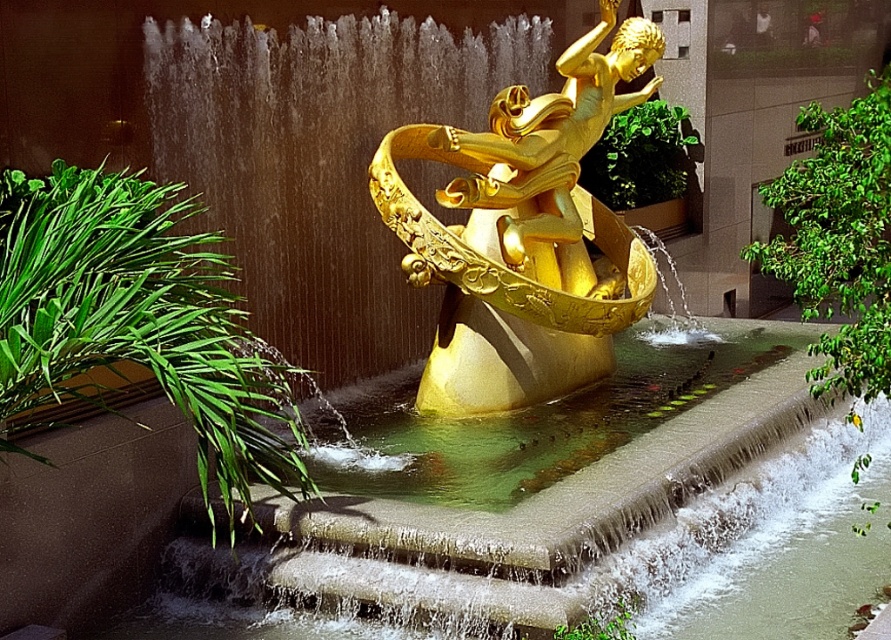
Question: Considering the real-world distances, which object is farthest from the clear water at fountain center?

Choices:
 (A) green leafy plant at left
 (B) gold polished statue at center
 (C) green leafy plant at lower center
 (D) green leafy plant at upper center

Answer: (D)

Question: Is clear water at fountain center smaller than gold polished statue at center?

Choices:
 (A) no
 (B) yes

Answer: (A)

Question: Which point is farther to the camera?

Choices:
 (A) green leafy plant at right
 (B) gold polished statue at center
 (C) green leafy plant at lower center
 (D) green leafy plant at left

Answer: (B)

Question: Is clear water at fountain center wider than green leafy plant at lower center?

Choices:
 (A) yes
 (B) no

Answer: (A)

Question: Which object is positioned farthest from the gold polished statue at center?

Choices:
 (A) green leafy plant at right
 (B) green leafy plant at upper center
 (C) clear water at fountain center
 (D) green leafy plant at left

Answer: (A)

Question: Can you confirm if green leafy plant at right is positioned below green leafy plant at upper center?

Choices:
 (A) yes
 (B) no

Answer: (A)